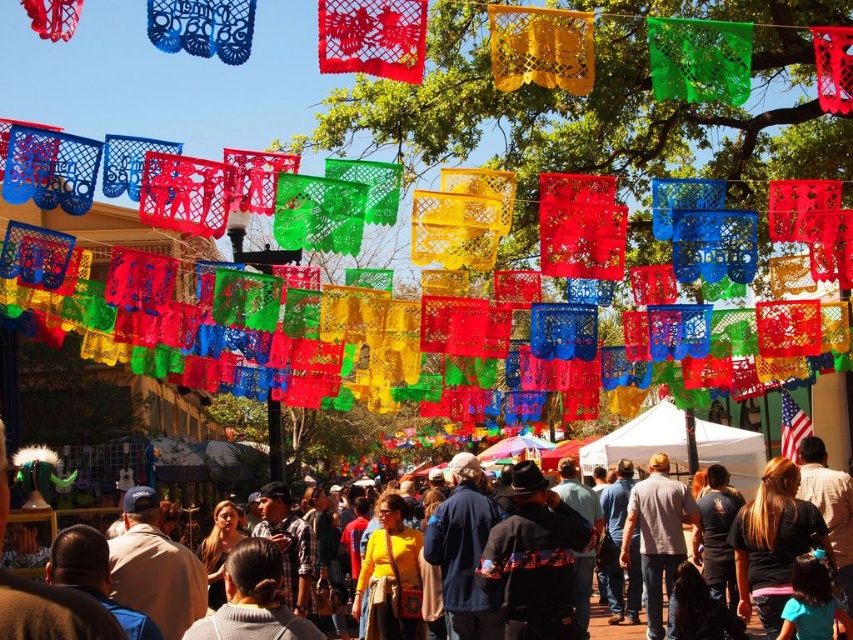
Question: Does yellow fabric purse at center have a lesser width compared to light gray cotton shirt at center?

Choices:
 (A) no
 (B) yes

Answer: (A)

Question: Can you confirm if yellow fabric purse at center is positioned to the left of light gray cotton shirt at center?

Choices:
 (A) no
 (B) yes

Answer: (B)

Question: In this image, where is yellow fabric purse at center located relative to light gray cotton shirt at center?

Choices:
 (A) below
 (B) above

Answer: (B)

Question: Among these objects, which one is nearest to the camera?

Choices:
 (A) yellow fabric purse at center
 (B) light gray cotton shirt at center

Answer: (A)

Question: Which point appears farthest from the camera in this image?

Choices:
 (A) (16, 621)
 (B) (627, 557)

Answer: (B)